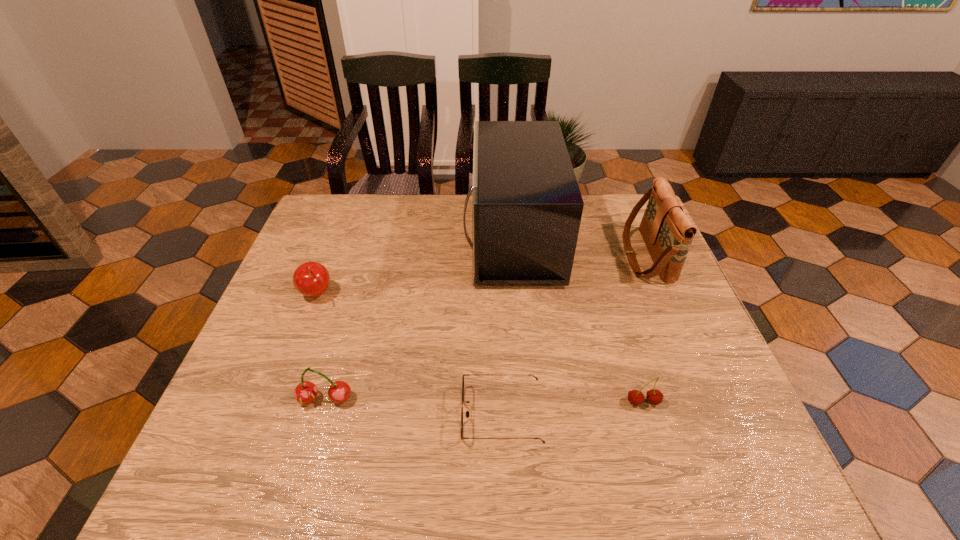
Identify the location of vacant space located with the door open on the microwave oven. (333, 238).

Locate an element on the screen. The height and width of the screenshot is (540, 960). vacant area located with the door open on the microwave oven is located at coordinates (336, 238).

You are a GUI agent. You are given a task and a screenshot of the screen. Output one action in this format:
    pyautogui.click(x=<x>, y=<y>)
    Task: Click on the blank area located 0.230m on the front-facing side of the rightmost object
    Image resolution: width=960 pixels, height=540 pixels.
    Given the screenshot: What is the action you would take?
    pyautogui.click(x=545, y=255)

Identify the location of vacant space located 0.110m on the front-facing side of the rightmost object. (587, 255).

Where is `blank space located 0.300m on the front-facing side of the rightmost object`? This screenshot has width=960, height=540. blank space located 0.300m on the front-facing side of the rightmost object is located at coordinates (520, 255).

Identify the location of vacant space located on the front of the leftmost object. This screenshot has height=540, width=960. (278, 391).

At what (x,y) coordinates should I click in order to perform the action: click on vacant space located 0.100m with stems pointing upwards on the second cherry from left to right. Please return your answer as a coordinate pair (x, y). This screenshot has height=540, width=960. Looking at the image, I should click on (308, 457).

What are the coordinates of `free space located on the surface of the second shortest object` in the screenshot? It's located at (660, 457).

Image resolution: width=960 pixels, height=540 pixels. I want to click on vacant area located on the front-facing side of the sunglasses, so click(x=428, y=414).

This screenshot has height=540, width=960. Identify the location of free space located 0.100m on the front-facing side of the sunglasses. (414, 414).